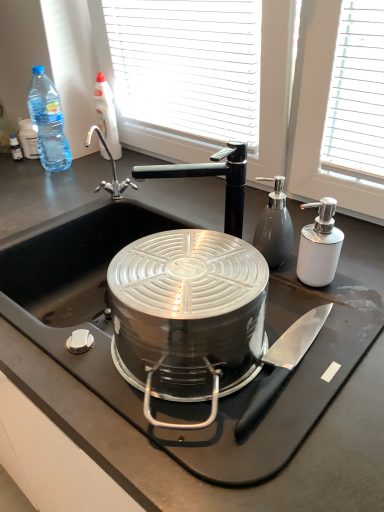
The image size is (384, 512). What do you see at coordinates (106, 115) in the screenshot?
I see `clear plastic bottle at upper left, which appears as the 2th bottle when viewed from the left` at bounding box center [106, 115].

The height and width of the screenshot is (512, 384). I want to click on blue plastic bottle at upper left, the first bottle in the left-to-right sequence, so click(x=48, y=122).

The image size is (384, 512). What do you see at coordinates (319, 245) in the screenshot?
I see `white glossy soap dispenser at right` at bounding box center [319, 245].

Describe the element at coordinates (274, 226) in the screenshot. This screenshot has width=384, height=512. I see `satin silver pump dispenser at right, the 3th bottle when ordered from back to front` at that location.

At what (x,y) coordinates should I click in order to perform the action: click on polished stainless steel knife at lower center. Please return your answer as a coordinate pair (x, y). Looking at the image, I should click on (281, 367).

Measure the distance between black matte faucet at upper center and clear plastic bottle at upper left, which ranks as the 1th bottle in back-to-front order.

black matte faucet at upper center is 21.95 inches away from clear plastic bottle at upper left, which ranks as the 1th bottle in back-to-front order.

From a real-world perspective, between black matte faucet at upper center and clear plastic bottle at upper left, which appears as the 2th bottle when viewed from the left, who is vertically higher?

clear plastic bottle at upper left, which appears as the 2th bottle when viewed from the left, from a real-world perspective.

The height and width of the screenshot is (512, 384). I want to click on tap below the clear plastic bottle at upper left, which ranks as the second bottle in right-to-left order (from the image's perspective), so click(x=212, y=176).

Is black matte faucet at upper center not inside clear plastic bottle at upper left, which appears as the 2th bottle when viewed from the left?

black matte faucet at upper center is positioned outside clear plastic bottle at upper left, which appears as the 2th bottle when viewed from the left.

Between satin silver pump dispenser at right, which is the 3th bottle from left to right, and clear plastic bottle at upper left, which ranks as the second bottle in right-to-left order, which one has smaller width?

Thinner between the two is satin silver pump dispenser at right, which is the 3th bottle from left to right.

Based on their sizes in the image, would you say satin silver pump dispenser at right, the 3th bottle when ordered from back to front, is bigger or smaller than clear plastic bottle at upper left, which ranks as the 1th bottle in back-to-front order?

satin silver pump dispenser at right, the 3th bottle when ordered from back to front, is smaller than clear plastic bottle at upper left, which ranks as the 1th bottle in back-to-front order.

Looking at this image, how many degrees apart are the facing directions of satin silver pump dispenser at right, the 3th bottle when ordered from back to front, and clear plastic bottle at upper left, which is the 3th bottle from front to back?

The angular difference between satin silver pump dispenser at right, the 3th bottle when ordered from back to front, and clear plastic bottle at upper left, which is the 3th bottle from front to back, is 28 degrees.

In terms of width, does polished stainless steel knife at lower center look wider or thinner when compared to white glossy soap dispenser at right?

Considering their sizes, polished stainless steel knife at lower center looks broader than white glossy soap dispenser at right.

Consider the image. Who is smaller, polished stainless steel knife at lower center or white glossy soap dispenser at right?

polished stainless steel knife at lower center is smaller.

From the image's perspective, is polished stainless steel knife at lower center over white glossy soap dispenser at right?

No, from the image's perspective, polished stainless steel knife at lower center is not over white glossy soap dispenser at right.

How much distance is there between white glossy soap dispenser at right and black matte countertop at center?

white glossy soap dispenser at right is 38.10 centimeters away from black matte countertop at center.

Is white glossy soap dispenser at right thinner than black matte countertop at center?

Correct, the width of white glossy soap dispenser at right is less than that of black matte countertop at center.

Between white glossy soap dispenser at right and black matte countertop at center, which one has smaller size?

white glossy soap dispenser at right is smaller.

From a real-world perspective, between white glossy soap dispenser at right and black matte countertop at center, who is vertically lower?

In real-world perspective, black matte countertop at center is lower.

Which object is more forward, white glossy soap dispenser at right or clear plastic bottle at upper left, which ranks as the second bottle in right-to-left order?

white glossy soap dispenser at right is more forward.

From the image's perspective, is white glossy soap dispenser at right located above or below clear plastic bottle at upper left, which is the 3th bottle from front to back?

Clearly, from the image's perspective, white glossy soap dispenser at right is below clear plastic bottle at upper left, which is the 3th bottle from front to back.

Is point (327, 209) positioned after point (97, 99)?

No, it is not.

At what (x,y) coordinates should I click in order to perform the action: click on countertop in front of the white glossy soap dispenser at right. Please return your answer as a coordinate pair (x, y). Looking at the image, I should click on (208, 484).

Is black matte countertop at center aimed at white glossy soap dispenser at right?

No.

Is black matte countertop at center next to white glossy soap dispenser at right?

black matte countertop at center and white glossy soap dispenser at right are not in contact.

Considering the relative sizes of black matte countertop at center and white glossy soap dispenser at right in the image provided, is black matte countertop at center wider than white glossy soap dispenser at right?

Correct, the width of black matte countertop at center exceeds that of white glossy soap dispenser at right.

Based on the photo, is clear plastic bottle at upper left, which ranks as the 1th bottle in back-to-front order, behind white glossy soap dispenser at right?

Yes, it is.

Who is shorter, clear plastic bottle at upper left, which appears as the 2th bottle when viewed from the left, or white glossy soap dispenser at right?

white glossy soap dispenser at right.

Which object is positioned more to the right, clear plastic bottle at upper left, which appears as the 2th bottle when viewed from the left, or white glossy soap dispenser at right?

Positioned to the right is white glossy soap dispenser at right.

Which is farther, [111,97] or [304,267]?

The point [111,97] is behind.

The width and height of the screenshot is (384, 512). What are the coordinates of `tap on the right of clear plastic bottle at upper left, which ranks as the second bottle in right-to-left order` in the screenshot? It's located at click(212, 176).

At what (x,y) coordinates should I click in order to perform the action: click on the 2nd bottle above the satin silver pump dispenser at right, positioned as the 1th bottle in right-to-left order (from the image's perspective). Please return your answer as a coordinate pair (x, y). This screenshot has height=512, width=384. Looking at the image, I should click on (106, 115).

Which object lies further to the anchor point polished stainless steel knife at lower center, clear plastic bottle at upper left, which ranks as the second bottle in right-to-left order, or satin silver pump dispenser at right, the 3th bottle when ordered from back to front?

Based on the image, clear plastic bottle at upper left, which ranks as the second bottle in right-to-left order, appears to be further to polished stainless steel knife at lower center.

Based on their spatial positions, is white glossy soap dispenser at right or blue plastic bottle at upper left, the second bottle when ordered from back to front, closer to satin silver pump dispenser at right, positioned as the 1th bottle in right-to-left order?

white glossy soap dispenser at right is closer to satin silver pump dispenser at right, positioned as the 1th bottle in right-to-left order.

Estimate the real-world distances between objects in this image. Which object is further from black matte faucet at upper center, clear plastic bottle at upper left, which ranks as the second bottle in right-to-left order, or satin silver pump dispenser at right, which is the 1th bottle in front-to-back order?

clear plastic bottle at upper left, which ranks as the second bottle in right-to-left order, lies further to black matte faucet at upper center than the other object.

From the image, which object appears to be farther from black matte faucet at upper center, polished stainless steel knife at lower center or blue plastic bottle at upper left, the first bottle in the left-to-right sequence?

blue plastic bottle at upper left, the first bottle in the left-to-right sequence, is positioned further to the anchor black matte faucet at upper center.

Which object lies nearer to the anchor point black matte countertop at center, satin silver pump dispenser at right, positioned as the 1th bottle in right-to-left order, or clear plastic bottle at upper left, which appears as the 2th bottle when viewed from the left?

The object closer to black matte countertop at center is satin silver pump dispenser at right, positioned as the 1th bottle in right-to-left order.

From the image, which object appears to be farther from satin silver pump dispenser at right, positioned as the 1th bottle in right-to-left order, clear plastic bottle at upper left, which ranks as the second bottle in right-to-left order, or white glossy soap dispenser at right?

Among the two, clear plastic bottle at upper left, which ranks as the second bottle in right-to-left order, is located further to satin silver pump dispenser at right, positioned as the 1th bottle in right-to-left order.

Estimate the real-world distances between objects in this image. Which object is further from black matte faucet at upper center, black matte countertop at center or blue plastic bottle at upper left, which appears as the 2th bottle when viewed from the front?

Based on the image, blue plastic bottle at upper left, which appears as the 2th bottle when viewed from the front, appears to be further to black matte faucet at upper center.

Which object lies nearer to the anchor point blue plastic bottle at upper left, acting as the third bottle starting from the right, white glossy soap dispenser at right or polished stainless steel knife at lower center?

white glossy soap dispenser at right lies closer to blue plastic bottle at upper left, acting as the third bottle starting from the right, than the other object.

This screenshot has height=512, width=384. What are the coordinates of `tap positioned between black matte countertop at center and clear plastic bottle at upper left, which appears as the 2th bottle when viewed from the left, from near to far` in the screenshot? It's located at (212, 176).

You are a GUI agent. You are given a task and a screenshot of the screen. Output one action in this format:
    pyautogui.click(x=<x>, y=<y>)
    Task: Click on the tap located between polished stainless steel knife at lower center and blue plastic bottle at upper left, the second bottle when ordered from back to front, in the depth direction
    
    Given the screenshot: What is the action you would take?
    pyautogui.click(x=212, y=176)

Identify the location of appliance between satin silver pump dispenser at right, the 3th bottle when ordered from back to front, and polished stainless steel knife at lower center in the up-down direction. (319, 245).

Find the location of a particular element. This screenshot has height=512, width=384. appliance between black matte countertop at center and clear plastic bottle at upper left, which appears as the 2th bottle when viewed from the left, from front to back is located at coordinates pos(319,245).